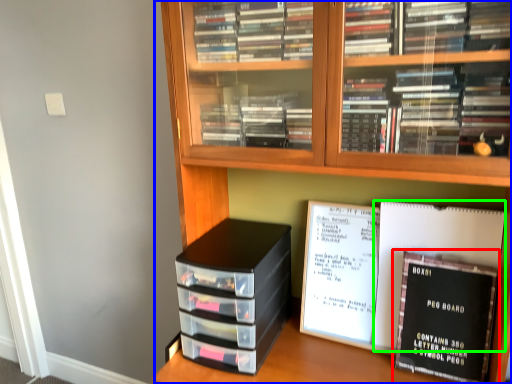
Question: Which is farther away from book (highlighted by a red box)? bookcase (highlighted by a blue box) or journal (highlighted by a green box)?

Choices:
 (A) bookcase
 (B) journal

Answer: (A)